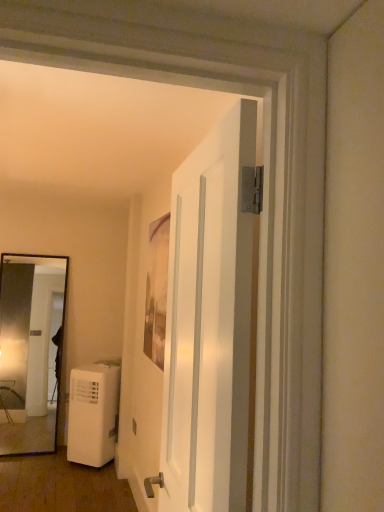
At what (x,y) coordinates should I click in order to perform the action: click on white matte air purifier at lower left. Please return your answer as a coordinate pair (x, y). The width and height of the screenshot is (384, 512). Looking at the image, I should click on (61, 486).

Image resolution: width=384 pixels, height=512 pixels. What do you see at coordinates (61, 486) in the screenshot? I see `white matte air purifier at lower left` at bounding box center [61, 486].

Describe the element at coordinates (93, 413) in the screenshot. I see `white plastic air conditioner at lower left` at that location.

Consider the image. In order to face white matte door at center, should I rotate leftwards or rightwards?

Turn right approximately 0.199 degrees to face it.

Where is `white matte air purifier at lower left`? white matte air purifier at lower left is located at coordinates (61, 486).

Which is correct: white plastic air conditioner at lower left is inside white matte air purifier at lower left, or outside of it?

white plastic air conditioner at lower left is outside white matte air purifier at lower left.

Considering the sizes of objects white plastic air conditioner at lower left and white matte air purifier at lower left in the image provided, who is wider, white plastic air conditioner at lower left or white matte air purifier at lower left?

Wider between the two is white matte air purifier at lower left.

Considering the sizes of objects white plastic air conditioner at lower left and white matte air purifier at lower left in the image provided, who is taller, white plastic air conditioner at lower left or white matte air purifier at lower left?

Standing taller between the two is white plastic air conditioner at lower left.

Which object is further away from the camera, white matte door at center or white plastic air conditioner at lower left?

white plastic air conditioner at lower left is more distant.

Are white matte door at center and white plastic air conditioner at lower left far apart?

white matte door at center is positioned a significant distance from white plastic air conditioner at lower left.

From a real-world perspective, is white matte door at center positioned above or below white plastic air conditioner at lower left?

From a real-world perspective, white matte door at center is physically above white plastic air conditioner at lower left.

How many degrees apart are the facing directions of white matte door at center and white matte air purifier at lower left?

white matte door at center and white matte air purifier at lower left are facing 88.6 degrees away from each other.

Identify the location of door above the white matte air purifier at lower left (from a real-world perspective). This screenshot has height=512, width=384. (209, 324).

Is white matte door at center placed right next to white matte air purifier at lower left?

They are not placed beside each other.

From the image's perspective, is white matte door at center below white matte air purifier at lower left?

Actually, white matte door at center appears above white matte air purifier at lower left in the image.

Is white plastic air conditioner at lower left to the right of white matte door at center from the viewer's perspective?

In fact, white plastic air conditioner at lower left is to the left of white matte door at center.

Which is correct: white plastic air conditioner at lower left is inside white matte door at center, or outside of it?

white plastic air conditioner at lower left exists outside the volume of white matte door at center.

Which of these two, white plastic air conditioner at lower left or white matte door at center, is smaller?

white matte door at center is smaller.

From the image's perspective, which one is positioned higher, white plastic air conditioner at lower left or white matte door at center?

white matte door at center, from the image's perspective.

Which is more to the right, white matte air purifier at lower left or white plastic air conditioner at lower left?

From the viewer's perspective, white plastic air conditioner at lower left appears more on the right side.

Does white matte air purifier at lower left turn towards white plastic air conditioner at lower left?

No, white matte air purifier at lower left is not facing towards white plastic air conditioner at lower left.

Is white matte air purifier at lower left bigger than white plastic air conditioner at lower left?

No.

Is white matte air purifier at lower left thinner than white plastic air conditioner at lower left?

In fact, white matte air purifier at lower left might be wider than white plastic air conditioner at lower left.

What are the coordinates of `door that is above the white matte air purifier at lower left (from the image's perspective)` in the screenshot? It's located at (209, 324).

Between white matte air purifier at lower left and white matte door at center, which one is positioned behind?

white matte air purifier at lower left.

Is white matte air purifier at lower left to the right of white matte door at center from the viewer's perspective?

Incorrect, white matte air purifier at lower left is not on the right side of white matte door at center.

From a real-world perspective, who is located higher, white matte air purifier at lower left or white matte door at center?

white matte door at center, from a real-world perspective.

You are a GUI agent. You are given a task and a screenshot of the screen. Output one action in this format:
    pyautogui.click(x=<x>, y=<y>)
    Task: Click on the corridor below the white plastic air conditioner at lower left (from the image's perspective)
    This screenshot has width=384, height=512.
    Given the screenshot: What is the action you would take?
    pyautogui.click(x=61, y=486)

This screenshot has height=512, width=384. I want to click on air conditioner to the left of white matte door at center, so click(x=93, y=413).

Estimate the real-world distances between objects in this image. Which object is further from white matte air purifier at lower left, white matte door at center or white plastic air conditioner at lower left?

The object further to white matte air purifier at lower left is white matte door at center.

Considering their positions, is white plastic air conditioner at lower left positioned further to white matte air purifier at lower left than white matte door at center?

white matte door at center.

From the image, which object appears to be farther from white matte door at center, white plastic air conditioner at lower left or white matte air purifier at lower left?

white plastic air conditioner at lower left.

Which object lies further to the anchor point white plastic air conditioner at lower left, white matte door at center or white matte air purifier at lower left?

Based on the image, white matte door at center appears to be further to white plastic air conditioner at lower left.

From the image, which object appears to be nearer to white plastic air conditioner at lower left, white matte air purifier at lower left or white matte door at center?

The object closer to white plastic air conditioner at lower left is white matte air purifier at lower left.

When comparing their distances from white matte door at center, does white matte air purifier at lower left or white plastic air conditioner at lower left seem further?

Among the two, white plastic air conditioner at lower left is located further to white matte door at center.

The width and height of the screenshot is (384, 512). What are the coordinates of `corridor between white matte door at center and white plastic air conditioner at lower left from front to back` in the screenshot? It's located at (61, 486).